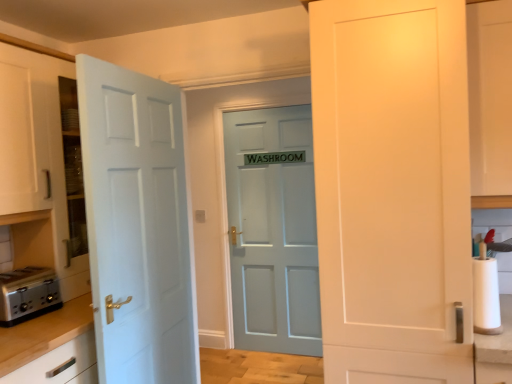
Image resolution: width=512 pixels, height=384 pixels. What do you see at coordinates (137, 226) in the screenshot?
I see `light blue painted door at left, positioned as the second door in back-to-front order` at bounding box center [137, 226].

At what (x,y) coordinates should I click in order to perform the action: click on white matte door at right, the 1th door when ordered from front to back. Please return your answer as a coordinate pair (x, y). Image resolution: width=512 pixels, height=384 pixels. Looking at the image, I should click on (392, 189).

The width and height of the screenshot is (512, 384). What do you see at coordinates (28, 294) in the screenshot?
I see `silver metallic toaster at lower left` at bounding box center [28, 294].

Where is `light blue painted door at left, positioned as the second door in back-to-front order`? The height and width of the screenshot is (384, 512). light blue painted door at left, positioned as the second door in back-to-front order is located at coordinates (137, 226).

Is point (388, 43) closer to camera compared to point (511, 125)?

Yes, it is in front of point (511, 125).

Considering the sizes of white matte door at right, the 1th door when ordered from front to back, and white glossy cabinet at upper right in the image, is white matte door at right, the 1th door when ordered from front to back, wider or thinner than white glossy cabinet at upper right?

Considering their sizes, white matte door at right, the 1th door when ordered from front to back, looks broader than white glossy cabinet at upper right.

Which object is closer to the camera, white matte door at right, the 1th door when ordered from front to back, or white glossy cabinet at upper right?

white matte door at right, the 1th door when ordered from front to back.

Is white matte door at right, the 1th door when ordered from front to back, not near white glossy cabinet at upper right?

No, there isn't a large distance between white matte door at right, the 1th door when ordered from front to back, and white glossy cabinet at upper right.

From a real-world perspective, is matte blue door at center, marked as the first door in a back-to-front arrangement, located higher than white glossy cabinet at left?

No, from a real-world perspective, matte blue door at center, marked as the first door in a back-to-front arrangement, is not over white glossy cabinet at left

From the image's perspective, is matte blue door at center, marked as the third door in a front-to-back arrangement, positioned above or below white glossy cabinet at left?

matte blue door at center, marked as the third door in a front-to-back arrangement, is situated lower than white glossy cabinet at left in the image.

Is matte blue door at center, marked as the first door in a back-to-front arrangement, not close to white glossy cabinet at left?

Yes.

Is matte blue door at center, marked as the third door in a front-to-back arrangement, looking in the opposite direction of white glossy cabinet at left?

No, matte blue door at center, marked as the third door in a front-to-back arrangement, is not facing the opposite direction of white glossy cabinet at left.

Considering the sizes of objects light blue painted door at left, the second door positioned from the front, and silver metallic toaster at lower left in the image provided, who is taller, light blue painted door at left, the second door positioned from the front, or silver metallic toaster at lower left?

light blue painted door at left, the second door positioned from the front, is taller.

From a real-world perspective, is light blue painted door at left, the second door positioned from the front, located higher than silver metallic toaster at lower left?

Yes, from a real-world perspective, light blue painted door at left, the second door positioned from the front, is on top of silver metallic toaster at lower left.

From the image's perspective, which object appears higher, light blue painted door at left, the second door positioned from the front, or silver metallic toaster at lower left?

light blue painted door at left, the second door positioned from the front, from the image's perspective.

Between matte blue door at center, marked as the third door in a front-to-back arrangement, and white paper at right, which one appears on the right side from the viewer's perspective?

white paper at right is more to the right.

Which of these two, matte blue door at center, marked as the third door in a front-to-back arrangement, or white paper at right, is smaller?

white paper at right is smaller.

From the picture: Is matte blue door at center, marked as the third door in a front-to-back arrangement, thinner than white paper at right?

Indeed, matte blue door at center, marked as the third door in a front-to-back arrangement, has a lesser width compared to white paper at right.

Which is correct: matte blue door at center, marked as the first door in a back-to-front arrangement, is inside white paper at right, or outside of it?

matte blue door at center, marked as the first door in a back-to-front arrangement, is spatially situated outside white paper at right.

Between white paper at right and matte blue door at center, marked as the third door in a front-to-back arrangement, which one has smaller size?

white paper at right is smaller.

Which door is the 2nd one when counting from the back of the white paper at right? Please provide its 2D coordinates.

[(273, 230)]

From a real-world perspective, between white paper at right and matte blue door at center, marked as the first door in a back-to-front arrangement, who is vertically higher?

white paper at right is physically above.

Is white paper at right positioned far away from matte blue door at center, marked as the first door in a back-to-front arrangement?

Yes, white paper at right is far from matte blue door at center, marked as the first door in a back-to-front arrangement.

In terms of width, does white glossy cabinet at upper right look wider or thinner when compared to white paper at right?

Clearly, white glossy cabinet at upper right has more width compared to white paper at right.

Is white glossy cabinet at upper right positioned far away from white paper at right?

No, there isn't a large distance between white glossy cabinet at upper right and white paper at right.

From the image's perspective, between white glossy cabinet at upper right and white paper at right, who is located below?

white paper at right appears lower in the image.

Which of these two, silver metallic toaster at lower left or white paper at right, is smaller?

With smaller size is white paper at right.

Can you confirm if silver metallic toaster at lower left is taller than white paper at right?

In fact, silver metallic toaster at lower left may be shorter than white paper at right.

Considering the positions of objects silver metallic toaster at lower left and white paper at right in the image provided, who is more to the left, silver metallic toaster at lower left or white paper at right?

From the viewer's perspective, silver metallic toaster at lower left appears more on the left side.

What's the angular difference between silver metallic toaster at lower left and white paper at right's facing directions?

The angle between the facing direction of silver metallic toaster at lower left and the facing direction of white paper at right is 89.8 degrees.

At what (x,y) coordinates should I click in order to perform the action: click on cabinetry lying on the right of white matte door at right, the 1th door when ordered from front to back. Please return your answer as a coordinate pair (x, y). Image resolution: width=512 pixels, height=384 pixels. Looking at the image, I should click on (490, 96).

Locate an element on the screen. Image resolution: width=512 pixels, height=384 pixels. dresser that appears above the matte blue door at center, marked as the third door in a front-to-back arrangement (from a real-world perspective) is located at coordinates (41, 220).

Consider the image. Which object lies further to the anchor point light blue painted door at left, positioned as the second door in back-to-front order, white paper at right or matte blue door at center, marked as the third door in a front-to-back arrangement?

white paper at right is positioned further to the anchor light blue painted door at left, positioned as the second door in back-to-front order.

Which object lies further to the anchor point white glossy cabinet at left, light blue painted door at left, the second door positioned from the front, or matte blue door at center, marked as the first door in a back-to-front arrangement?

Among the two, matte blue door at center, marked as the first door in a back-to-front arrangement, is located further to white glossy cabinet at left.

Estimate the real-world distances between objects in this image. Which object is further from light blue painted door at left, the second door positioned from the front, white paper at right or white glossy cabinet at upper right?

white glossy cabinet at upper right lies further to light blue painted door at left, the second door positioned from the front, than the other object.

Estimate the real-world distances between objects in this image. Which object is further from white paper at right, matte blue door at center, marked as the first door in a back-to-front arrangement, or white glossy cabinet at upper right?

matte blue door at center, marked as the first door in a back-to-front arrangement, is positioned further to the anchor white paper at right.

Based on their spatial positions, is white paper at right or white glossy cabinet at upper right further from white matte door at right, acting as the 3th door starting from the back?

Among the two, white glossy cabinet at upper right is located further to white matte door at right, acting as the 3th door starting from the back.

Estimate the real-world distances between objects in this image. Which object is further from silver metallic toaster at lower left, matte blue door at center, marked as the third door in a front-to-back arrangement, or white matte door at right, the 1th door when ordered from front to back?

matte blue door at center, marked as the third door in a front-to-back arrangement.

Considering their positions, is light blue painted door at left, positioned as the second door in back-to-front order, positioned closer to matte blue door at center, marked as the first door in a back-to-front arrangement, than white glossy cabinet at upper right?

Among the two, light blue painted door at left, positioned as the second door in back-to-front order, is located nearer to matte blue door at center, marked as the first door in a back-to-front arrangement.

Looking at the image, which one is located further to silver metallic toaster at lower left, white glossy cabinet at left or white paper at right?

white paper at right lies further to silver metallic toaster at lower left than the other object.

Locate an element on the screen. dresser situated between silver metallic toaster at lower left and light blue painted door at left, positioned as the second door in back-to-front order, from left to right is located at coordinates (41, 220).

Locate an element on the screen. door positioned between white paper at right and matte blue door at center, marked as the third door in a front-to-back arrangement, from near to far is located at coordinates (137, 226).

This screenshot has height=384, width=512. I want to click on cabinetry between white matte door at right, the 1th door when ordered from front to back, and matte blue door at center, marked as the third door in a front-to-back arrangement, from front to back, so click(490, 96).

At what (x,y) coordinates should I click in order to perform the action: click on door between white glossy cabinet at upper right and matte blue door at center, marked as the first door in a back-to-front arrangement, from front to back. Please return your answer as a coordinate pair (x, y). This screenshot has height=384, width=512. Looking at the image, I should click on coord(137,226).